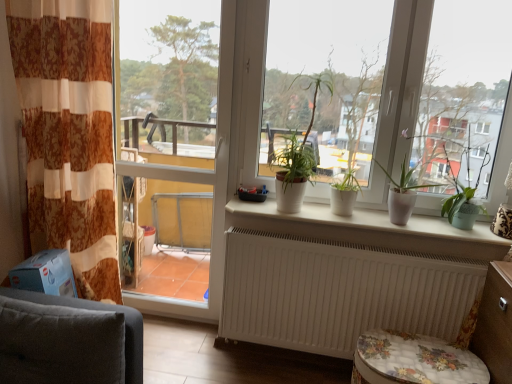
This screenshot has height=384, width=512. Describe the element at coordinates (297, 151) in the screenshot. I see `white matte plant pot at center, placed as the first houseplant when sorted from left to right` at that location.

The image size is (512, 384). Describe the element at coordinates (344, 194) in the screenshot. I see `white matte pot at center, which is the 2th houseplant from left to right` at that location.

The width and height of the screenshot is (512, 384). What are the coordinates of `brown floral fabric curtain at left` in the screenshot? It's located at (69, 133).

What are the coordinates of `white matte plant pot at center, marked as the third houseplant in a right-to-left arrangement` in the screenshot? It's located at (297, 151).

Is white matte pot at center, which is the 2th houseplant from left to right, to the left or to the right of white matte pot at center, the first houseplant from the right, in the image?

In the image, white matte pot at center, which is the 2th houseplant from left to right, appears on the left side of white matte pot at center, the first houseplant from the right.

Is white matte pot at center, which is the 3th houseplant in left-to-right order, at the back of white matte pot at center, marked as the second houseplant in a right-to-left arrangement?

No, white matte pot at center, marked as the second houseplant in a right-to-left arrangement,'s orientation is not away from white matte pot at center, which is the 3th houseplant in left-to-right order.

Looking at their sizes, would you say white matte pot at center, marked as the second houseplant in a right-to-left arrangement, is wider or thinner than white matte pot at center, which is the 3th houseplant in left-to-right order?

white matte pot at center, marked as the second houseplant in a right-to-left arrangement, is thinner than white matte pot at center, which is the 3th houseplant in left-to-right order.

From the image's perspective, is green matte plant at right under transparent glass screen door at left?

Indeed, from the image's perspective, green matte plant at right is shown beneath transparent glass screen door at left.

Would you say green matte plant at right is inside or outside transparent glass screen door at left?

green matte plant at right is not enclosed by transparent glass screen door at left.

Is green matte plant at right positioned with its back to transparent glass screen door at left?

No, transparent glass screen door at left is not at the back of green matte plant at right.

Does green matte plant at right appear on the right side of transparent glass screen door at left?

Yes.

From the image's perspective, is floral fabric music stool at lower right located above transparent glass screen door at left?

No, from the image's perspective, floral fabric music stool at lower right is not above transparent glass screen door at left.

Which is behind, point (407, 361) or point (218, 225)?

The point (218, 225) is more distant.

Based on the photo, who is bigger, floral fabric music stool at lower right or transparent glass screen door at left?

transparent glass screen door at left.

Find the location of a particular element. music stool to the right of transparent glass screen door at left is located at coordinates (414, 360).

Which object is positioned more to the right, white matte window at center or white ceramic plant pots at center?

Positioned to the right is white matte window at center.

Considering the relative positions of white matte window at center and white ceramic plant pots at center in the image provided, is white matte window at center behind white ceramic plant pots at center?

That is False.

How many degrees apart are the facing directions of white matte window at center and white ceramic plant pots at center?

The facing directions of white matte window at center and white ceramic plant pots at center are 0.221 degrees apart.

From a real-world perspective, is white matte window at center physically located above or below white ceramic plant pots at center?

white matte window at center is above white ceramic plant pots at center.

Which of these two, white matte window at center or white matte radiator at lower center, is smaller?

white matte radiator at lower center.

This screenshot has width=512, height=384. Find the location of `radiator beneath the white matte window at center (from a real-world perspective)`. radiator beneath the white matte window at center (from a real-world perspective) is located at coordinates (339, 292).

Which object is wider, white matte plant pot at center, placed as the first houseplant when sorted from left to right, or white ceramic plant pots at center?

With larger width is white ceramic plant pots at center.

In the scene shown: How far apart are white matte plant pot at center, marked as the third houseplant in a right-to-left arrangement, and white ceramic plant pots at center?

The distance of white matte plant pot at center, marked as the third houseplant in a right-to-left arrangement, from white ceramic plant pots at center is 14.86 inches.

Can we say white matte plant pot at center, marked as the third houseplant in a right-to-left arrangement, lies outside white ceramic plant pots at center?

white matte plant pot at center, marked as the third houseplant in a right-to-left arrangement, lies outside white ceramic plant pots at center's area.

In the scene shown: Is white matte plant pot at center, marked as the third houseplant in a right-to-left arrangement, oriented towards white ceramic plant pots at center?

No.

Considering the sizes of objects floral fabric music stool at lower right and dark gray fabric armchair at lower left in the image provided, who is taller, floral fabric music stool at lower right or dark gray fabric armchair at lower left?

dark gray fabric armchair at lower left.

Find the location of a particular element. The image size is (512, 384). music stool behind the dark gray fabric armchair at lower left is located at coordinates (414, 360).

Based on the photo, considering the relative sizes of floral fabric music stool at lower right and dark gray fabric armchair at lower left in the image provided, is floral fabric music stool at lower right thinner than dark gray fabric armchair at lower left?

No, floral fabric music stool at lower right is not thinner than dark gray fabric armchair at lower left.

From the picture: Is floral fabric music stool at lower right with dark gray fabric armchair at lower left?

No, floral fabric music stool at lower right is not with dark gray fabric armchair at lower left.

Locate an element on the screen. houseplant that is the 1st one when counting forward from the white matte pot at center, marked as the second houseplant in a right-to-left arrangement is located at coordinates (402, 192).

Locate an element on the screen. This screenshot has width=512, height=384. screen door below the green matte plant at right (from a real-world perspective) is located at coordinates (181, 134).

When comparing their distances from white ceramic plant pots at center, does white matte window at center or white matte pot at center, the first houseplant from the right, seem further?

white matte window at center is further to white ceramic plant pots at center.

Based on the photo, estimate the real-world distances between objects in this image. Which object is further from white matte radiator at lower center, transparent glass screen door at left or white matte plant pot at center, placed as the first houseplant when sorted from left to right?

The object further to white matte radiator at lower center is transparent glass screen door at left.

Considering their positions, is white matte pot at center, which is the 2th houseplant from left to right, positioned further to white matte plant pot at center, marked as the third houseplant in a right-to-left arrangement, than transparent glass screen door at left?

Based on the image, transparent glass screen door at left appears to be further to white matte plant pot at center, marked as the third houseplant in a right-to-left arrangement.

Estimate the real-world distances between objects in this image. Which object is further from green matte plant at right, white ceramic plant pots at center or white matte pot at center, which is the 2th houseplant from left to right?

The object further to green matte plant at right is white matte pot at center, which is the 2th houseplant from left to right.

Which object lies further to the anchor point dark gray fabric armchair at lower left, white matte plant pot at center, marked as the third houseplant in a right-to-left arrangement, or brown floral fabric curtain at left?

white matte plant pot at center, marked as the third houseplant in a right-to-left arrangement, is positioned further to the anchor dark gray fabric armchair at lower left.

Estimate the real-world distances between objects in this image. Which object is closer to white matte radiator at lower center, green matte plant at right or white matte pot at center, which is the 3th houseplant in left-to-right order?

Based on the image, white matte pot at center, which is the 3th houseplant in left-to-right order, appears to be nearer to white matte radiator at lower center.

From the image, which object appears to be farther from white matte plant pot at center, placed as the first houseplant when sorted from left to right, dark gray fabric armchair at lower left or white matte pot at center, marked as the second houseplant in a right-to-left arrangement?

dark gray fabric armchair at lower left is further to white matte plant pot at center, placed as the first houseplant when sorted from left to right.

Consider the image. Looking at the image, which one is located further to green matte plant at right, brown floral fabric curtain at left or white matte pot at center, which is the 2th houseplant from left to right?

Among the two, brown floral fabric curtain at left is located further to green matte plant at right.

What are the coordinates of `radiator situated between transparent glass screen door at left and green matte plant at right from left to right` in the screenshot? It's located at click(339, 292).

The height and width of the screenshot is (384, 512). I want to click on screen door between brown floral fabric curtain at left and floral fabric music stool at lower right from left to right, so click(x=181, y=134).

Where is `armchair between brown floral fabric curtain at left and white matte pot at center, which is the 3th houseplant in left-to-right order, in the horizontal direction`? armchair between brown floral fabric curtain at left and white matte pot at center, which is the 3th houseplant in left-to-right order, in the horizontal direction is located at coordinates (99, 310).

Locate an element on the screen. The image size is (512, 384). music stool between dark gray fabric armchair at lower left and white matte pot at center, which is the 3th houseplant in left-to-right order is located at coordinates (414, 360).